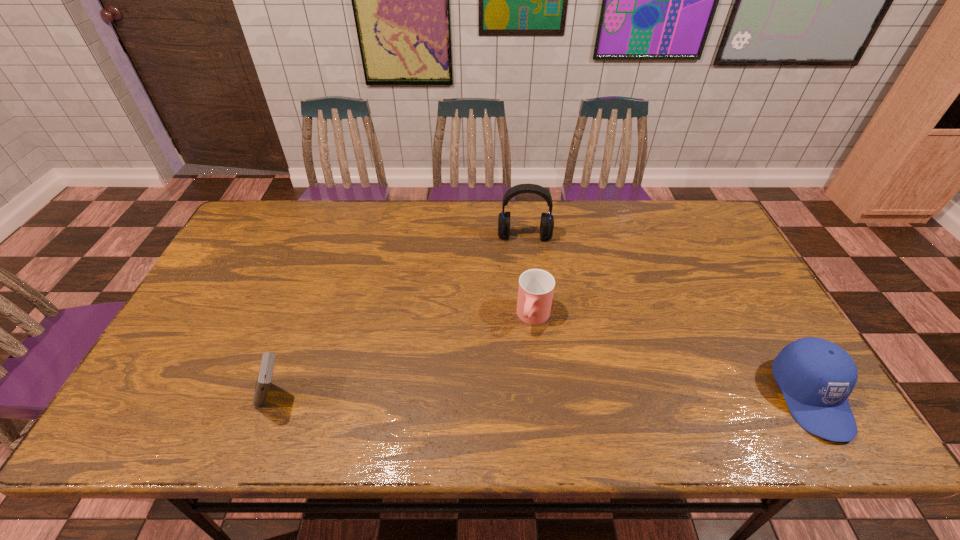
Where is `vacant space on the desktop that is between the calculator and the rightmost object and is positioned on the headband of the headset`? This screenshot has width=960, height=540. vacant space on the desktop that is between the calculator and the rightmost object and is positioned on the headband of the headset is located at coordinates point(529,397).

The height and width of the screenshot is (540, 960). In order to click on free spot on the desktop that is between the leftmost object and the rightmost object and is positioned on the side of the cup with the handle in this screenshot , I will do `click(501, 397)`.